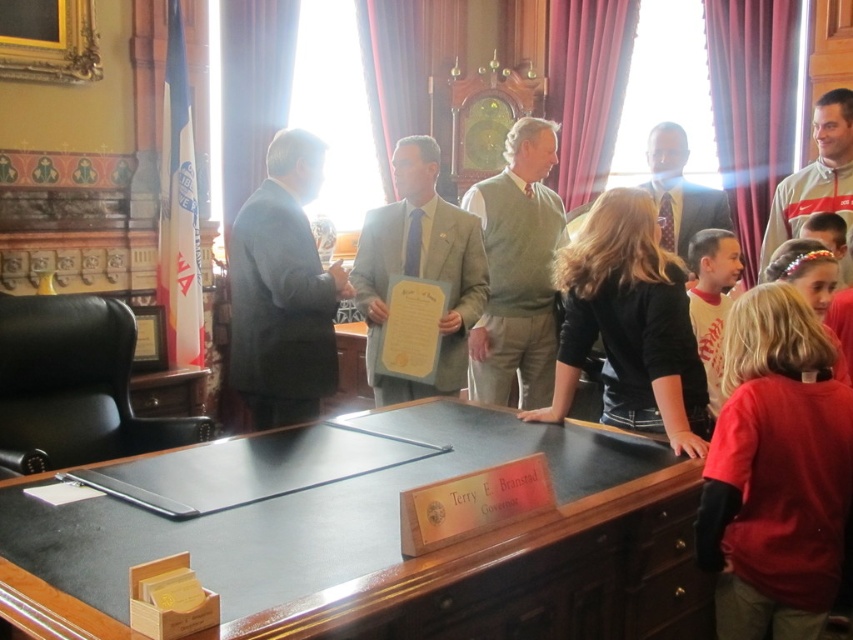
Question: Does light beige suit at center have a lesser width compared to red cotton shirt at center?

Choices:
 (A) no
 (B) yes

Answer: (A)

Question: Is gray suit at center to the right of wooden plaque at center from the viewer's perspective?

Choices:
 (A) no
 (B) yes

Answer: (A)

Question: Estimate the real-world distances between objects in this image. Which object is farther from the gray fleece jacket at upper right?

Choices:
 (A) yellow paper at center
 (B) black matte shirt at center
 (C) light beige suit at center

Answer: (A)

Question: Estimate the real-world distances between objects in this image. Which object is farther from the dark brown polished wood table at center?

Choices:
 (A) yellow paper at center
 (B) gray fleece jacket at upper right
 (C) matte gray suit at center
 (D) black matte shirt at center

Answer: (B)

Question: Which of the following is the farthest from the observer?

Choices:
 (A) dark brown polished wood table at center
 (B) matte gray suit at center

Answer: (B)

Question: Considering the relative positions of dark brown polished wood table at center and gray fleece jacket at upper right in the image provided, where is dark brown polished wood table at center located with respect to gray fleece jacket at upper right?

Choices:
 (A) above
 (B) below

Answer: (B)